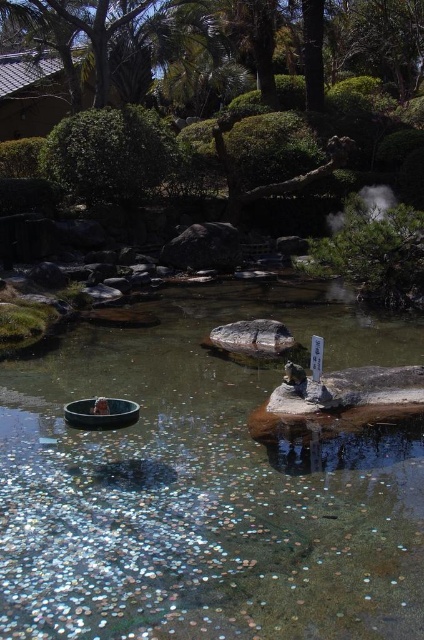
Question: Does dark gray rock at center appear over smooth gray rock at center?

Choices:
 (A) no
 (B) yes

Answer: (B)

Question: Which of the following is the closest to the observer?

Choices:
 (A) white vapor at upper right
 (B) dark gray rock at center

Answer: (A)

Question: Which point is farther to the camera?

Choices:
 (A) (396, 531)
 (B) (365, 196)
 (C) (220, 234)
 (D) (226, 339)

Answer: (B)

Question: Which point is farther from the camera taking this photo?

Choices:
 (A) (245, 442)
 (B) (204, 240)
 (C) (289, 348)

Answer: (B)

Question: Can you confirm if dark gray rock at center is wider than smooth gray rock at center?

Choices:
 (A) no
 (B) yes

Answer: (B)

Question: Is dark gray rock at center positioned behind white vapor at upper right?

Choices:
 (A) no
 (B) yes

Answer: (B)